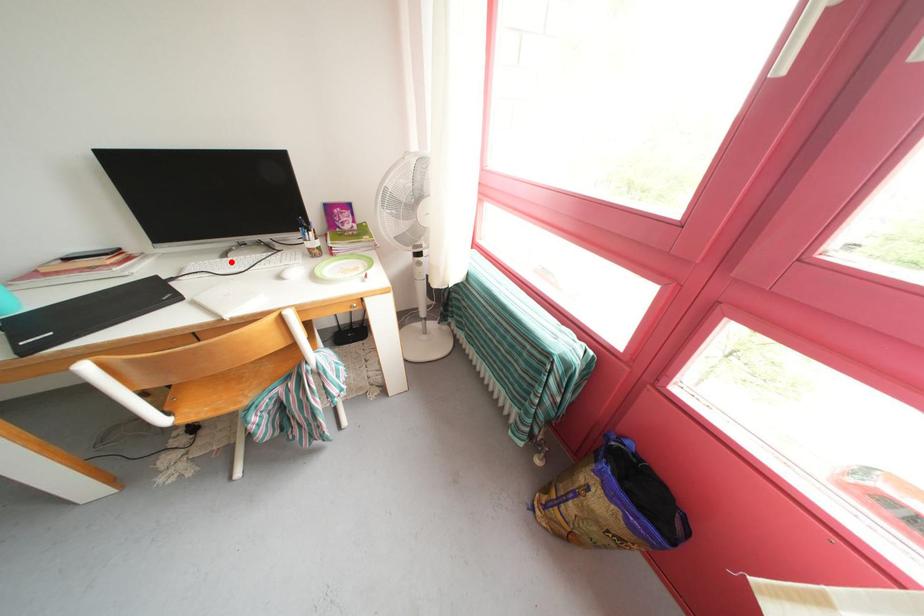
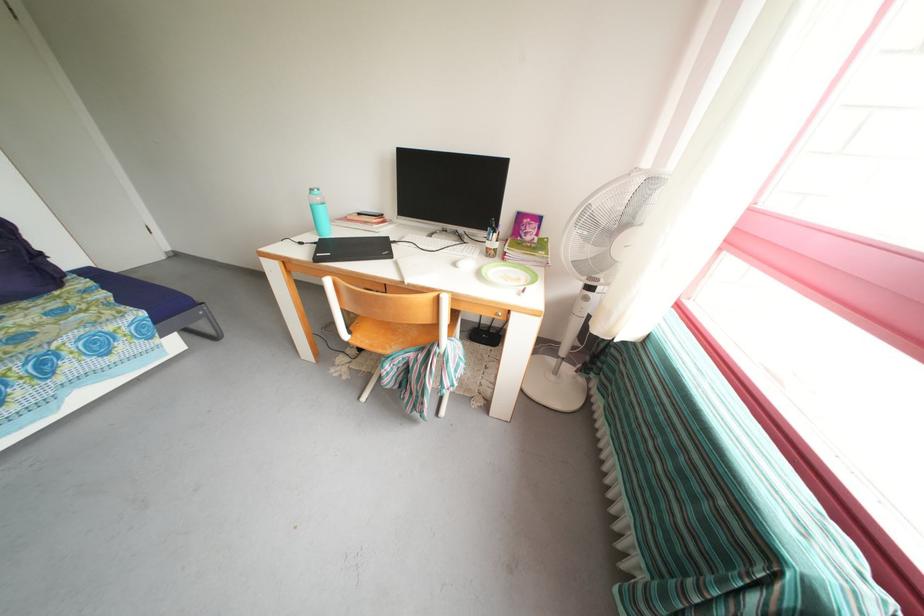
Locate, in the second image, the point that corresponds to the highlighted location in the first image.

(436, 241)